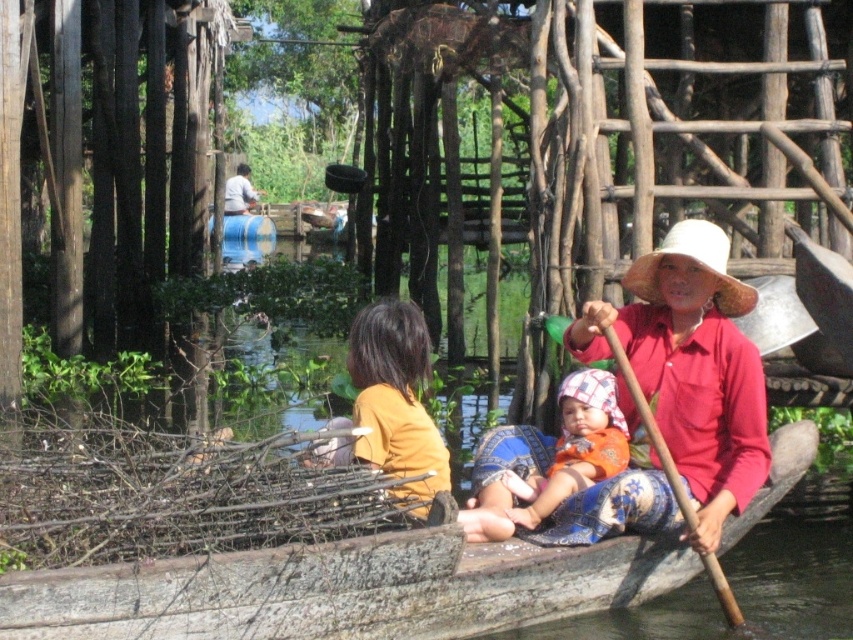
Question: Which of the following is the closest to the observer?

Choices:
 (A) wooden boat at center
 (B) white straw hat at center
 (C) orange cotton cloth at center

Answer: (A)

Question: Does white straw hat at center appear on the right side of light blue fabric at upper center?

Choices:
 (A) no
 (B) yes

Answer: (B)

Question: Which is nearer to the white straw hat at center?

Choices:
 (A) orange cotton cloth at center
 (B) wooden boat at center
 (C) brown wood paddle at center
 (D) light blue fabric at upper center

Answer: (C)

Question: Considering the relative positions of orange cotton cloth at center and brown wood paddle at center in the image provided, where is orange cotton cloth at center located with respect to brown wood paddle at center?

Choices:
 (A) left
 (B) right

Answer: (A)

Question: Which object is positioned closest to the wooden boat at center?

Choices:
 (A) orange cotton cloth at center
 (B) white straw hat at center
 (C) brown wood paddle at center
 (D) light blue fabric at upper center

Answer: (A)

Question: Does brown wood paddle at center appear over light blue fabric at upper center?

Choices:
 (A) no
 (B) yes

Answer: (A)